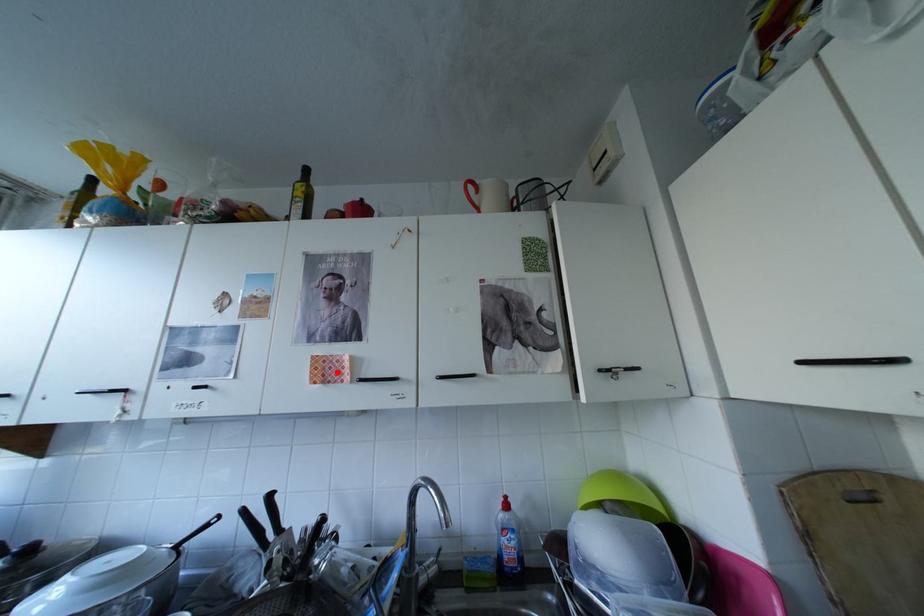
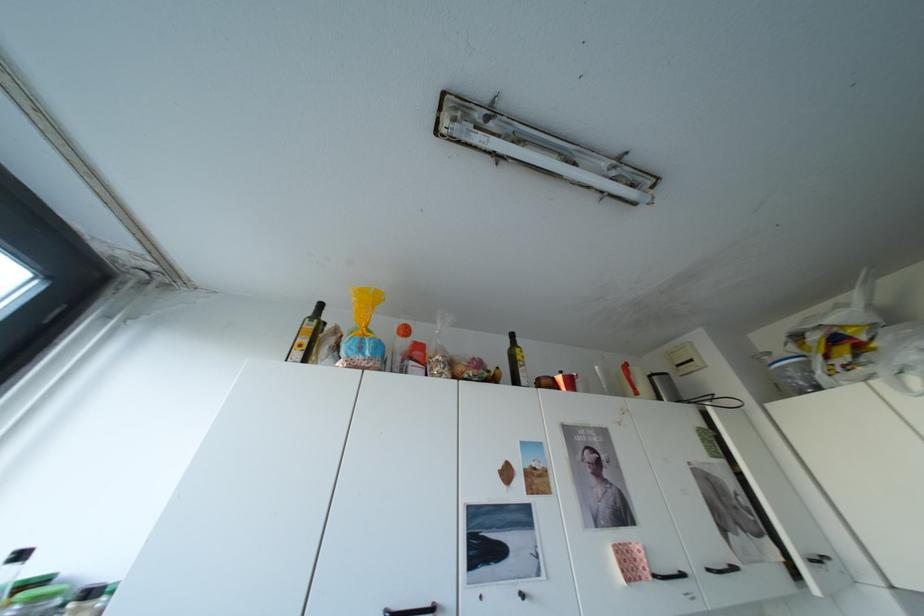
Locate, in the second image, the point that corresponds to the highlighted location in the first image.

(642, 568)